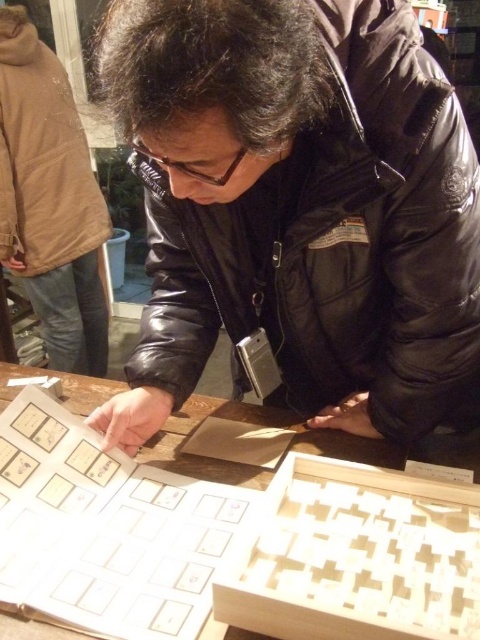
Question: Can you confirm if black leather jacket at center is wider than wooden table at center?

Choices:
 (A) no
 (B) yes

Answer: (A)

Question: Can you confirm if black leather jacket at center is bigger than wooden table at center?

Choices:
 (A) yes
 (B) no

Answer: (A)

Question: Among these points, which one is farthest from the camera?

Choices:
 (A) click(474, 346)
 (B) click(24, 620)

Answer: (A)

Question: Can you confirm if black leather jacket at center is smaller than wooden table at center?

Choices:
 (A) yes
 (B) no

Answer: (B)